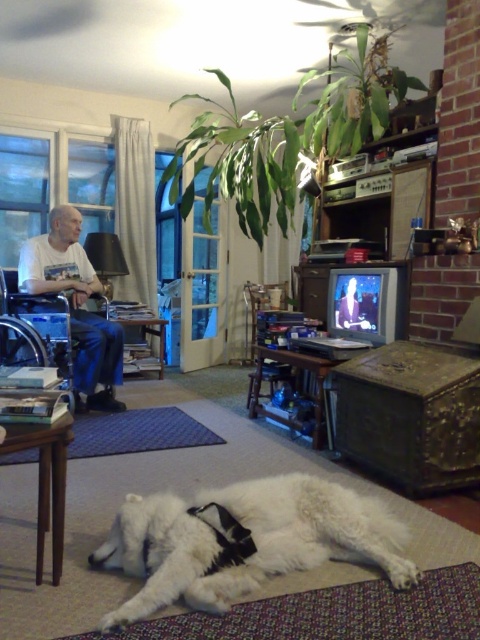
Consider the image. Which is more to the right, white fluffy dog at lower center or white cotton shirt at left?

white fluffy dog at lower center

Where is `white fluffy dog at lower center`? This screenshot has height=640, width=480. white fluffy dog at lower center is located at coordinates (243, 541).

Image resolution: width=480 pixels, height=640 pixels. What are the coordinates of `white fluffy dog at lower center` in the screenshot? It's located at (243, 541).